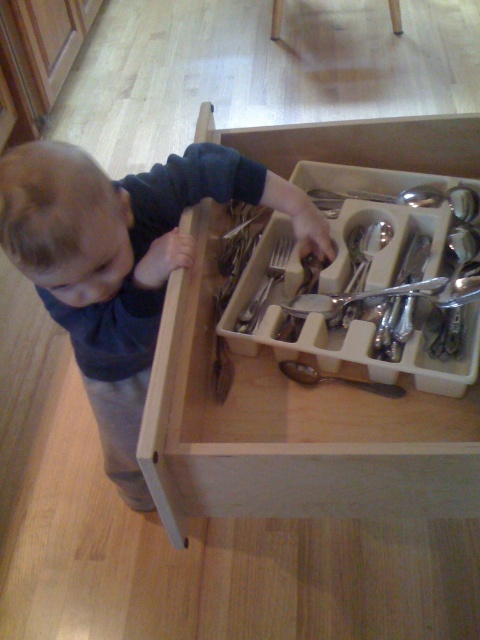
You are a parent in the kitchen. You notice a point at coordinates (372,284) inside the open drawer. What is located at that point?

The point at coordinates (372,284) is on the satin silverware at center, so the satin silverware at center is located there.

You are a child trying to reach into the kitchen drawer. There are two points inside the drawer labeled as point A and point B. Point A is at coordinate point (43, 296) and point B is at coordinate point (297, 301). Which point is easier to reach? Please answer based on their positions relative to the drawer opening.

Point A at coordinate point (43, 296) is closer to the camera than point B at coordinate point (297, 301), so it is easier to reach.